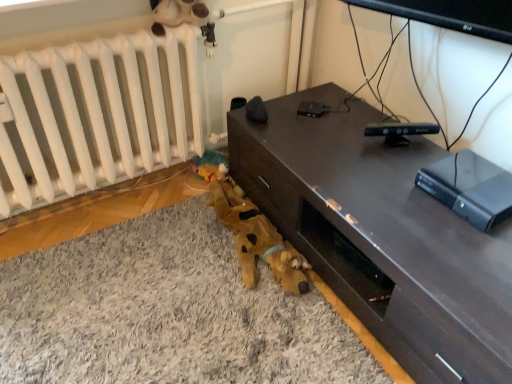
Locate an element on the screen. free spot in front of black plastic remote control at center, the second gadget positioned from the front is located at coordinates [x=318, y=130].